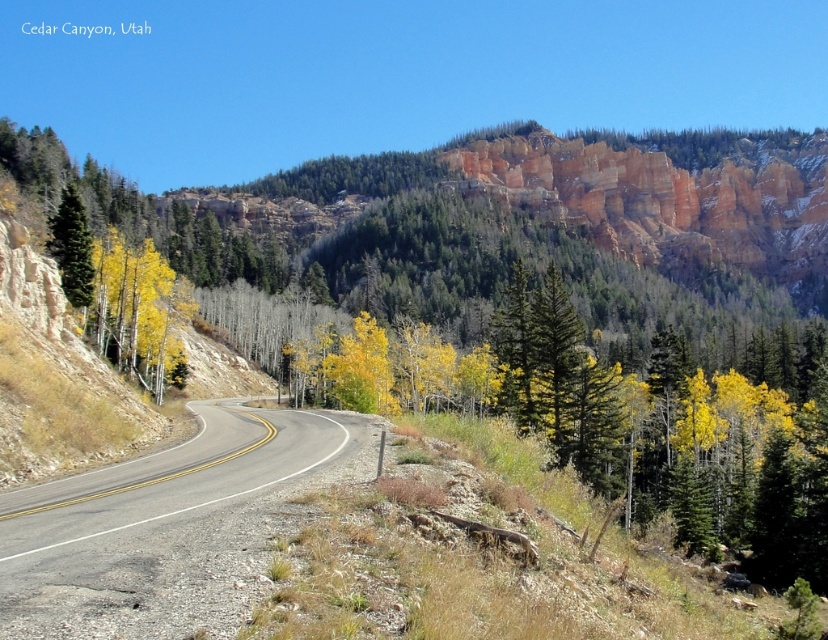
Question: Does yellow-green foliage at center lie in front of green matte tree at left?

Choices:
 (A) yes
 (B) no

Answer: (A)

Question: Which point is closer to the camera?

Choices:
 (A) yellow-green foliage at center
 (B) asphalt road at center

Answer: (B)

Question: Can you confirm if yellow-green foliage at center is positioned to the right of asphalt road at center?

Choices:
 (A) no
 (B) yes

Answer: (B)

Question: Is asphalt road at center to the right of green matte tree at left from the viewer's perspective?

Choices:
 (A) yes
 (B) no

Answer: (A)

Question: Which point appears farthest from the camera in this image?

Choices:
 (A) (66, 292)
 (B) (493, 180)
 (C) (292, 422)

Answer: (B)

Question: Which of the following is the farthest from the observer?

Choices:
 (A) yellow-green foliage at center
 (B) asphalt road at center
 (C) green matte tree at left

Answer: (C)